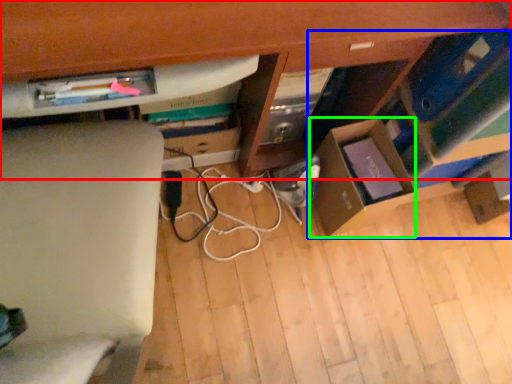
Question: Considering the real-world distances, which object is closest to computer desk (highlighted by a red box)? shelf (highlighted by a blue box) or cardboard box (highlighted by a green box).

Choices:
 (A) shelf
 (B) cardboard box

Answer: (A)